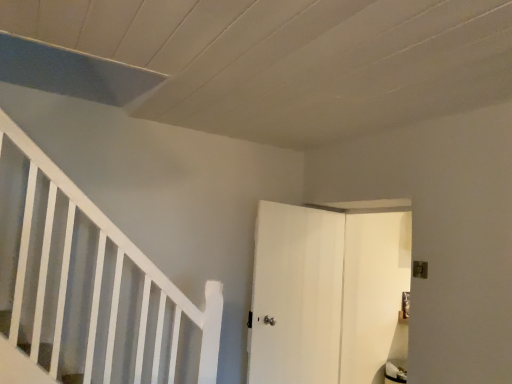
Question: Which direction should I rotate to look at white matte door at center, the first door when ordered from right to left, — up or down?

Choices:
 (A) up
 (B) down

Answer: (B)

Question: Is smooth gray stair at lower left to the left of white matte door at center, which ranks as the 1th door in left-to-right order, from the viewer's perspective?

Choices:
 (A) no
 (B) yes

Answer: (B)

Question: From the image's perspective, is smooth gray stair at lower left on top of white matte door at center, which ranks as the 1th door in left-to-right order?

Choices:
 (A) yes
 (B) no

Answer: (A)

Question: Considering the relative sizes of smooth gray stair at lower left and white matte door at center, which ranks as the 1th door in left-to-right order, in the image provided, is smooth gray stair at lower left shorter than white matte door at center, which ranks as the 1th door in left-to-right order,?

Choices:
 (A) yes
 (B) no

Answer: (A)

Question: From the image's perspective, is smooth gray stair at lower left below white matte door at center, which ranks as the 1th door in left-to-right order?

Choices:
 (A) yes
 (B) no

Answer: (B)

Question: Is smooth gray stair at lower left thinner than white matte door at center, which ranks as the 1th door in left-to-right order?

Choices:
 (A) yes
 (B) no

Answer: (B)

Question: Can you confirm if smooth gray stair at lower left is wider than white matte door at center, which ranks as the 1th door in left-to-right order?

Choices:
 (A) yes
 (B) no

Answer: (A)

Question: Are white matte door at center, the first door when ordered from right to left, and white matte door at center, which ranks as the 1th door in left-to-right order, beside each other?

Choices:
 (A) no
 (B) yes

Answer: (A)

Question: Is white matte door at center, the first door when ordered from right to left, taller than white matte door at center, which is counted as the second door, starting from the right?

Choices:
 (A) no
 (B) yes

Answer: (B)

Question: Is white matte door at center, the first door when ordered from right to left, positioned beyond the bounds of white matte door at center, which ranks as the 1th door in left-to-right order?

Choices:
 (A) no
 (B) yes

Answer: (B)

Question: Are white matte door at center, the first door when ordered from right to left, and white matte door at center, which ranks as the 1th door in left-to-right order, far apart?

Choices:
 (A) no
 (B) yes

Answer: (A)

Question: Is white matte door at center, the first door when ordered from right to left, smaller than white matte door at center, which ranks as the 1th door in left-to-right order?

Choices:
 (A) no
 (B) yes

Answer: (A)

Question: Is the depth of white matte door at center, the first door when ordered from right to left, less than that of white matte door at center, which ranks as the 1th door in left-to-right order?

Choices:
 (A) no
 (B) yes

Answer: (B)

Question: Is white matte door at center, which ranks as the 1th door in left-to-right order, oriented away from smooth gray stair at lower left?

Choices:
 (A) no
 (B) yes

Answer: (A)